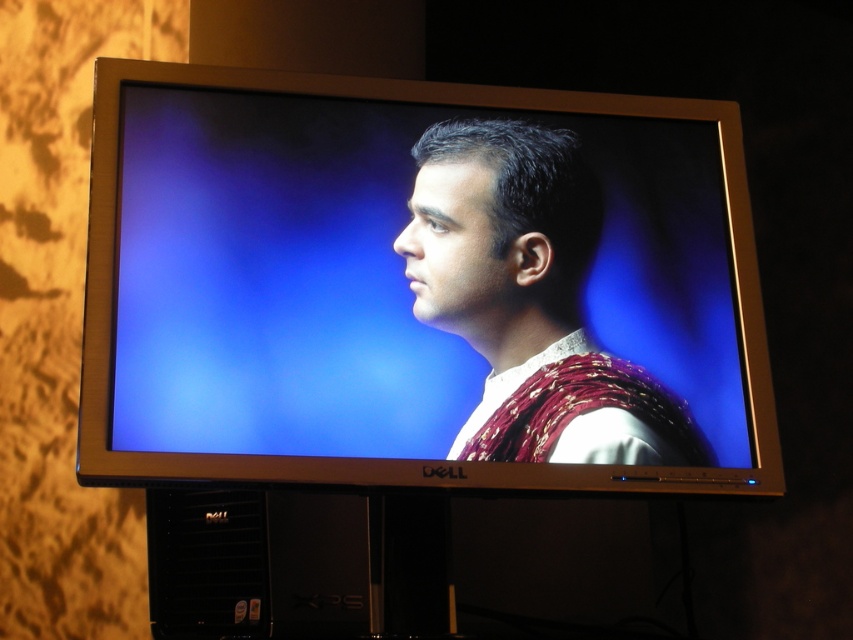
Does satin silver monitor at center have a greater height compared to matte purple fabric at center?

Yes, satin silver monitor at center is taller than matte purple fabric at center.

Which is above, satin silver monitor at center or matte purple fabric at center?

Positioned higher is satin silver monitor at center.

Who is more distant from viewer, (256, 416) or (460, 451)?

The point (460, 451) is behind.

Find the location of a particular element. satin silver monitor at center is located at coordinates (418, 288).